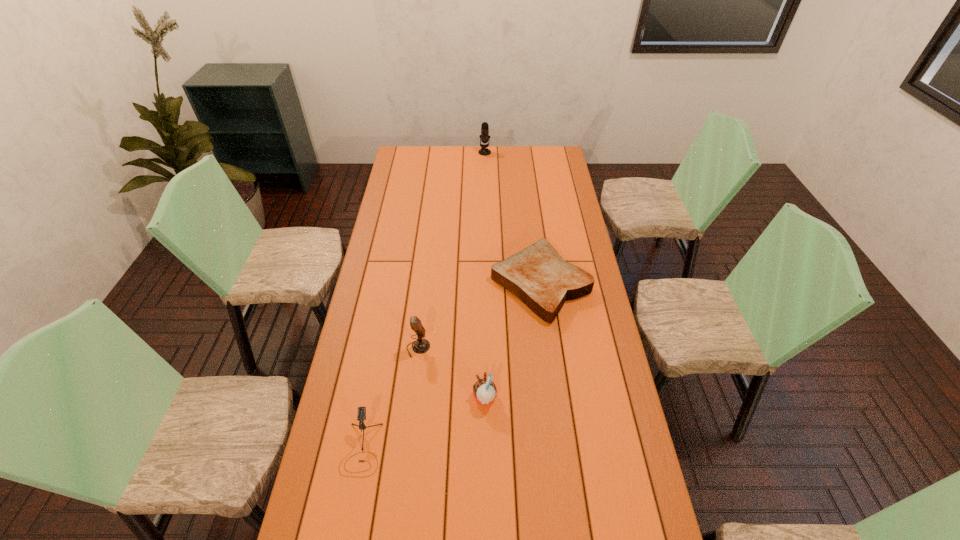
Identify the location of vacant space located on the front-facing side of the third farthest object. (536, 348).

The width and height of the screenshot is (960, 540). I want to click on free space located on the front-facing side of the fourth farthest object, so click(404, 398).

Locate an element on the screen. Image resolution: width=960 pixels, height=540 pixels. free space located on the front-facing side of the fourth farthest object is located at coordinates (432, 398).

At what (x,y) coordinates should I click in order to perform the action: click on free region located on the front-facing side of the fourth farthest object. Please return your answer as a coordinate pair (x, y). This screenshot has height=540, width=960. Looking at the image, I should click on (420, 398).

At what (x,y) coordinates should I click in order to perform the action: click on free space located 0.080m on the stand of the leftmost object. Please return your answer as a coordinate pair (x, y). The width and height of the screenshot is (960, 540). Looking at the image, I should click on (350, 508).

This screenshot has width=960, height=540. In order to click on vacant space situated on the left of the bread in this screenshot , I will do `click(451, 284)`.

The width and height of the screenshot is (960, 540). In order to click on object located in the far edge section of the desktop in this screenshot , I will do `click(484, 137)`.

The width and height of the screenshot is (960, 540). Identify the location of object located in the left edge section of the desktop. (361, 415).

Image resolution: width=960 pixels, height=540 pixels. What are the coordinates of `object situated at the right edge` in the screenshot? It's located at click(x=537, y=275).

Locate an element on the screen. The height and width of the screenshot is (540, 960). blank space at the far edge is located at coordinates (439, 151).